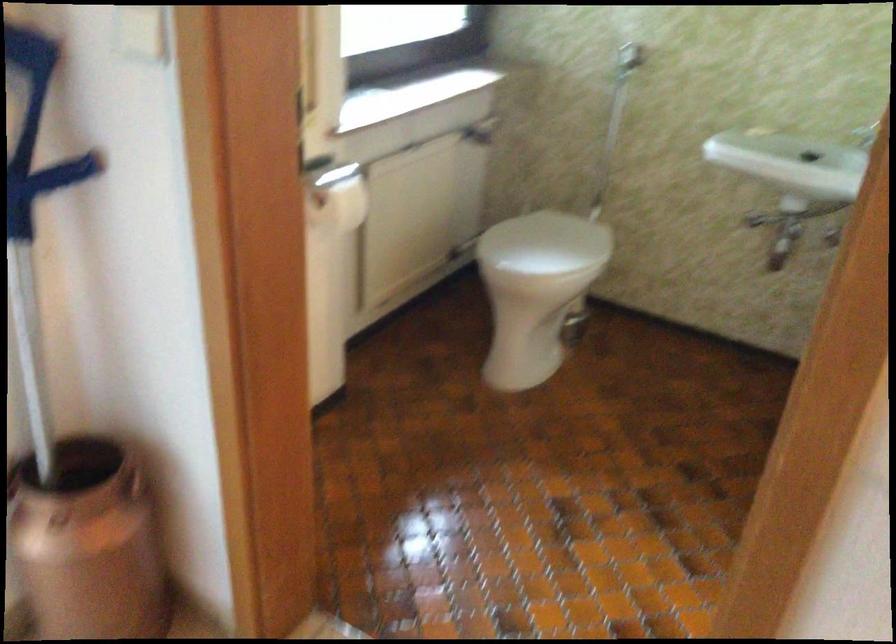
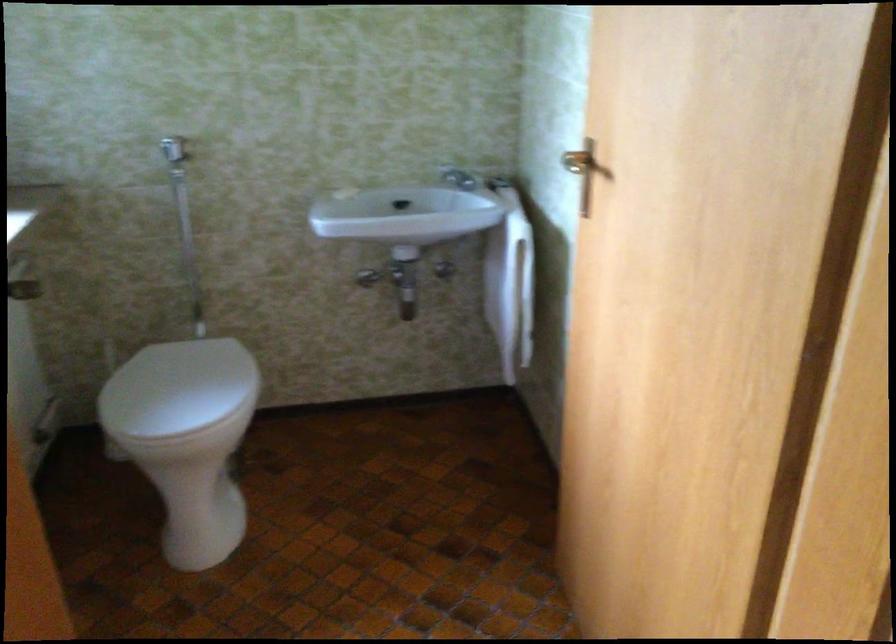
Question: How did the camera likely rotate?

Choices:
 (A) Left
 (B) Right
 (C) Up
 (D) Down

Answer: (B)